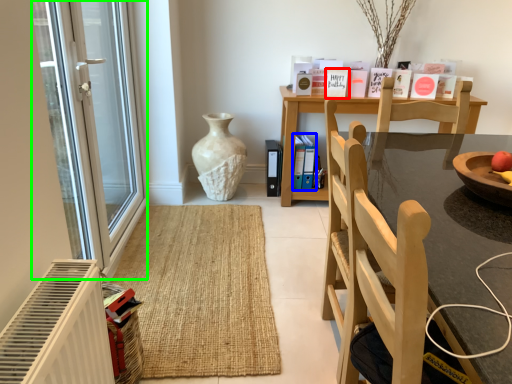
Question: Which is nearer to the book (highlighted by a red box)? book (highlighted by a blue box) or glass door (highlighted by a green box).

Choices:
 (A) book
 (B) glass door

Answer: (A)